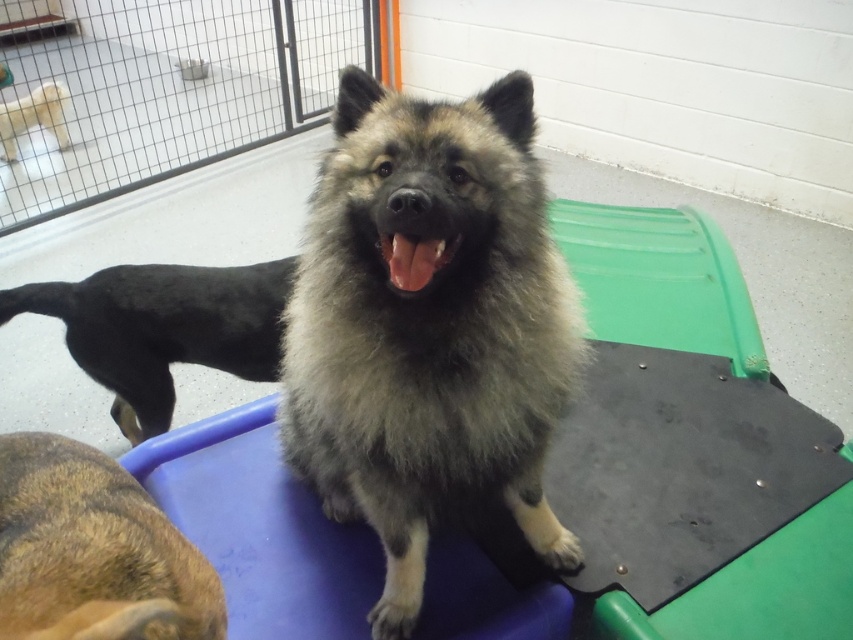
Question: Which object is positioned closest to the light brown fur at upper left?

Choices:
 (A) brown fur at lower left
 (B) black fur dog at center

Answer: (B)

Question: Can you confirm if fuzzy gray dog at center is positioned to the left of brown fur at lower left?

Choices:
 (A) no
 (B) yes

Answer: (A)

Question: Does fuzzy gray dog at center come in front of brown fur at lower left?

Choices:
 (A) no
 (B) yes

Answer: (A)

Question: Which point is closer to the camera?

Choices:
 (A) (264, 355)
 (B) (469, 125)
 (C) (10, 128)

Answer: (B)

Question: Among these points, which one is nearest to the camera?

Choices:
 (A) (126, 321)
 (B) (56, 634)
 (C) (419, 392)

Answer: (B)

Question: Is fuzzy gray dog at center thinner than black fur dog at center?

Choices:
 (A) yes
 (B) no

Answer: (A)